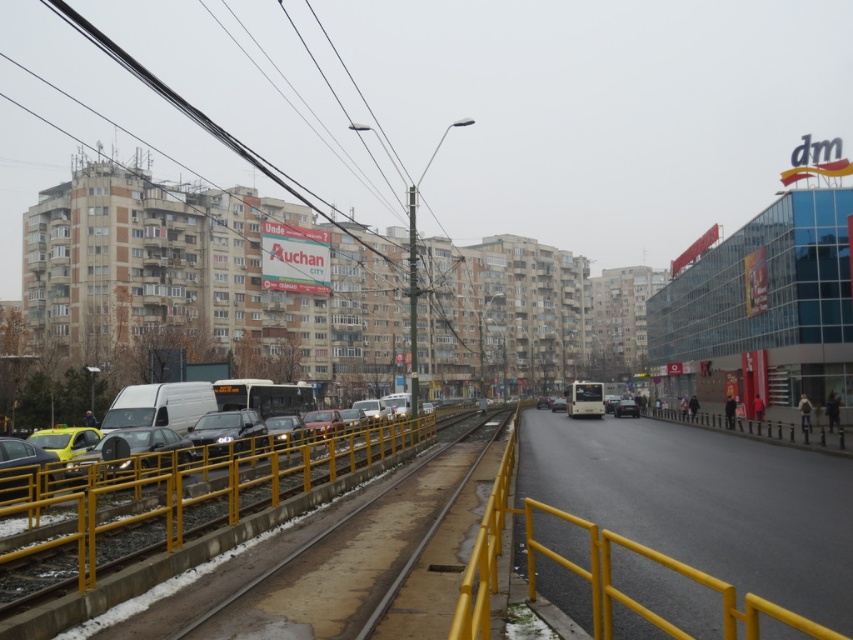
You are a pedestrian standing on the sidewalk and want to cross the road to reach a store on the other side. You see the yellow metal train track at center and the dark gray metallic car at center. Which object is closer to you as you prepare to cross?

The yellow metal train track at center is closer to the viewer than the dark gray metallic car at center, so the train track is closer to you as you prepare to cross.

You are a pedestrian standing on the sidewalk and want to cross the road to reach a store on the other side. There is a yellow metal train track at center and a dark gray metallic car at center. Which object should you avoid stepping on to stay safe?

You should avoid stepping on the yellow metal train track at center because it is positioned to the left of the dark gray metallic car at center, indicating it is part of the tram infrastructure and could be in use.